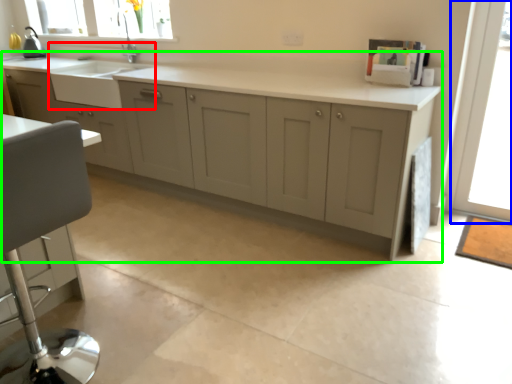
Question: Which object is the closest to the sink (highlighted by a red box)? Choose among these: window screen (highlighted by a blue box) or cabinetry (highlighted by a green box).

Choices:
 (A) window screen
 (B) cabinetry

Answer: (B)